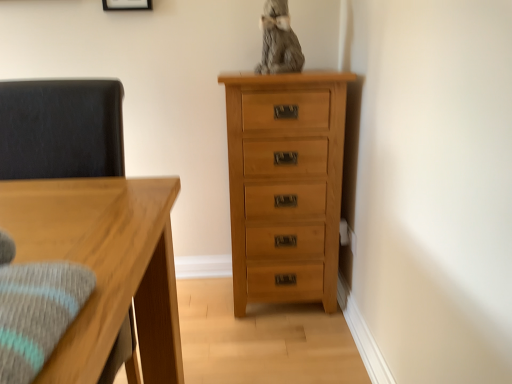
Question: From the image's perspective, is dark gray fabric swivel chair at left over natural wood chest of drawers at right?

Choices:
 (A) no
 (B) yes

Answer: (B)

Question: Considering the relative sizes of dark gray fabric swivel chair at left and natural wood chest of drawers at right in the image provided, is dark gray fabric swivel chair at left wider than natural wood chest of drawers at right?

Choices:
 (A) yes
 (B) no

Answer: (B)

Question: Does dark gray fabric swivel chair at left have a lesser height compared to natural wood chest of drawers at right?

Choices:
 (A) no
 (B) yes

Answer: (B)

Question: From a real-world perspective, is dark gray fabric swivel chair at left below natural wood chest of drawers at right?

Choices:
 (A) yes
 (B) no

Answer: (B)

Question: Would you say dark gray fabric swivel chair at left is outside natural wood chest of drawers at right?

Choices:
 (A) no
 (B) yes

Answer: (B)

Question: From the image's perspective, is dark gray fabric swivel chair at left below natural wood chest of drawers at right?

Choices:
 (A) yes
 (B) no

Answer: (B)

Question: Could you tell me if dark gray fabric swivel chair at left is facing matte white picture frame at upper center?

Choices:
 (A) yes
 (B) no

Answer: (B)

Question: Are dark gray fabric swivel chair at left and matte white picture frame at upper center beside each other?

Choices:
 (A) yes
 (B) no

Answer: (B)

Question: Is dark gray fabric swivel chair at left positioned far away from matte white picture frame at upper center?

Choices:
 (A) yes
 (B) no

Answer: (B)

Question: Considering the relative positions of dark gray fabric swivel chair at left and matte white picture frame at upper center in the image provided, is dark gray fabric swivel chair at left to the right of matte white picture frame at upper center from the viewer's perspective?

Choices:
 (A) yes
 (B) no

Answer: (B)

Question: From a real-world perspective, is dark gray fabric swivel chair at left on matte white picture frame at upper center?

Choices:
 (A) no
 (B) yes

Answer: (A)

Question: From a real-world perspective, is dark gray fabric swivel chair at left positioned under matte white picture frame at upper center based on gravity?

Choices:
 (A) no
 (B) yes

Answer: (B)

Question: Is matte white picture frame at upper center completely or partially outside of natural wood chest of drawers at right?

Choices:
 (A) yes
 (B) no

Answer: (A)